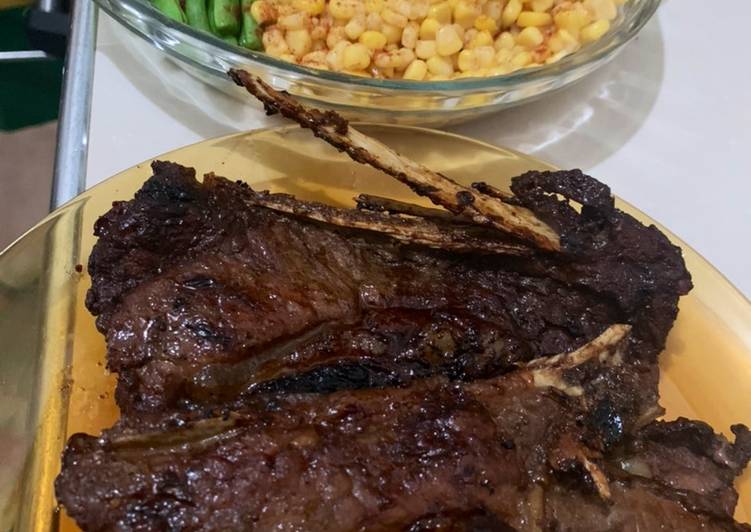
The image size is (751, 532). In order to click on white counter in this screenshot , I will do `click(716, 174)`.